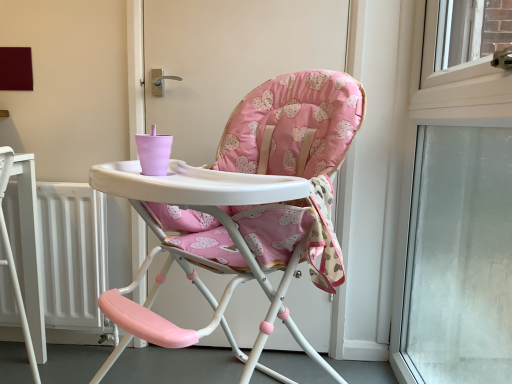
Locate an element on the screen. This screenshot has height=384, width=512. free space that is in between pink fabric highchair at center and white matte radiator at lower left is located at coordinates (177, 357).